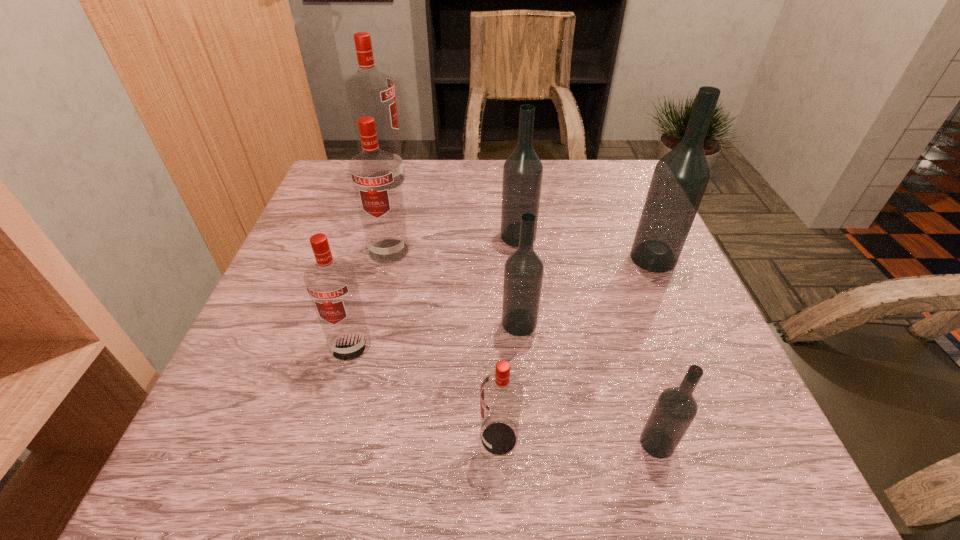
Image resolution: width=960 pixels, height=540 pixels. What are the coordinates of `free point located 0.130m on the front label of the nearest red vodka` in the screenshot? It's located at (393, 438).

Where is `vacant space located on the back of the second object from right to left`? This screenshot has width=960, height=540. vacant space located on the back of the second object from right to left is located at coordinates (612, 296).

Find the location of `object present at the far edge`. object present at the far edge is located at coordinates (370, 92).

I want to click on object located in the far left corner section of the desktop, so click(370, 92).

The height and width of the screenshot is (540, 960). Find the location of `object that is positioned at the near right corner`. object that is positioned at the near right corner is located at coordinates (675, 409).

The image size is (960, 540). What are the coordinates of `vacant area at the far edge` in the screenshot? It's located at (431, 206).

Image resolution: width=960 pixels, height=540 pixels. What are the coordinates of `blank area at the near edge` in the screenshot? It's located at (323, 451).

Find the location of `vacant space at the left edge of the desktop`. vacant space at the left edge of the desktop is located at coordinates (325, 225).

Identify the location of vacant space at the right edge of the desktop. (x=636, y=303).

You are a GUI agent. You are given a task and a screenshot of the screen. Output one action in this format:
    pyautogui.click(x=<x>, y=<y>)
    Task: Click on the vacant space at the far left corner of the desktop
    The width and height of the screenshot is (960, 540).
    Given the screenshot: What is the action you would take?
    pyautogui.click(x=340, y=192)